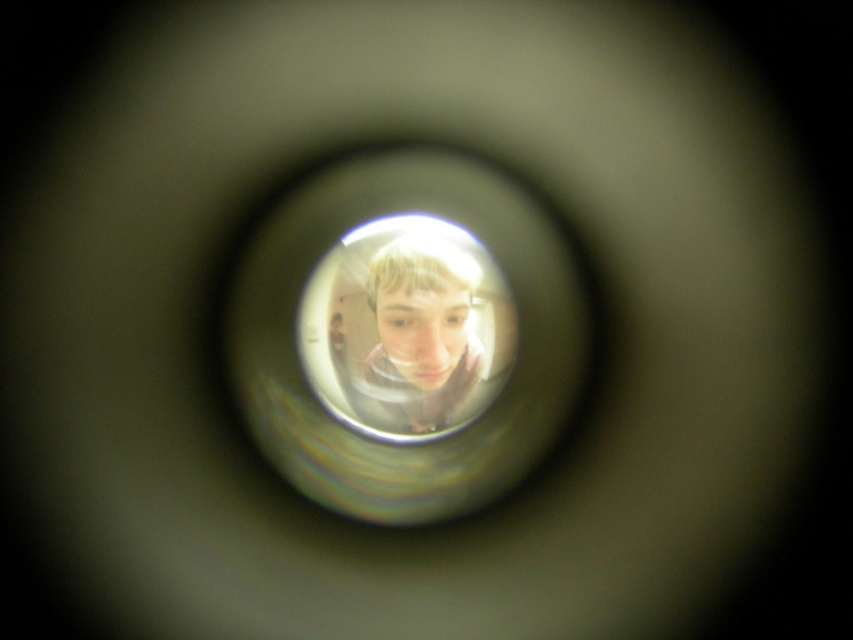
You are a photographer trying to adjust the focus of your camera. The transparent glass lens at center is represented by point (405, 336). Where should you position your camera to ensure the subject is in focus?

The transparent glass lens at center is represented by point (405, 336). To ensure the subject is in focus, position the camera so that the lens aligns with the subject at the center coordinates provided.

You are a photographer trying to capture a similar circular vignette effect. Where should you place the transparent glass lens at center to achieve this effect?

To achieve the circular vignette effect, place the transparent glass lens at center at point (405, 336).